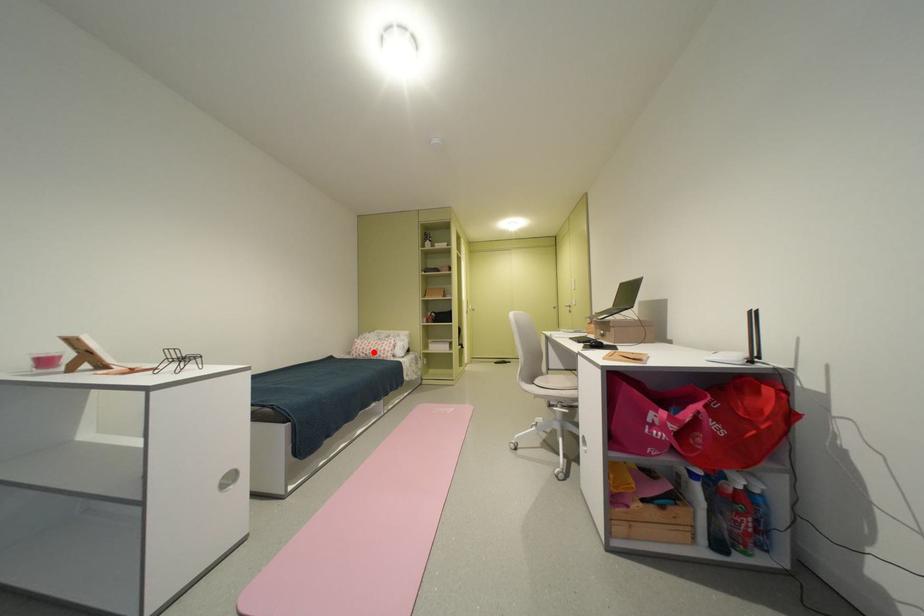
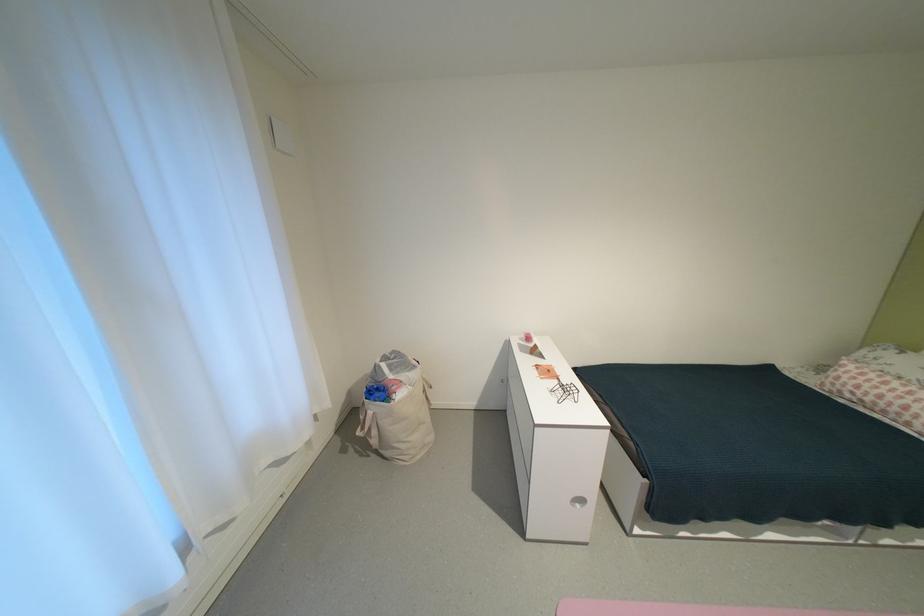
Find the pixel in the second image that matches the highlighted location in the first image.

(867, 392)